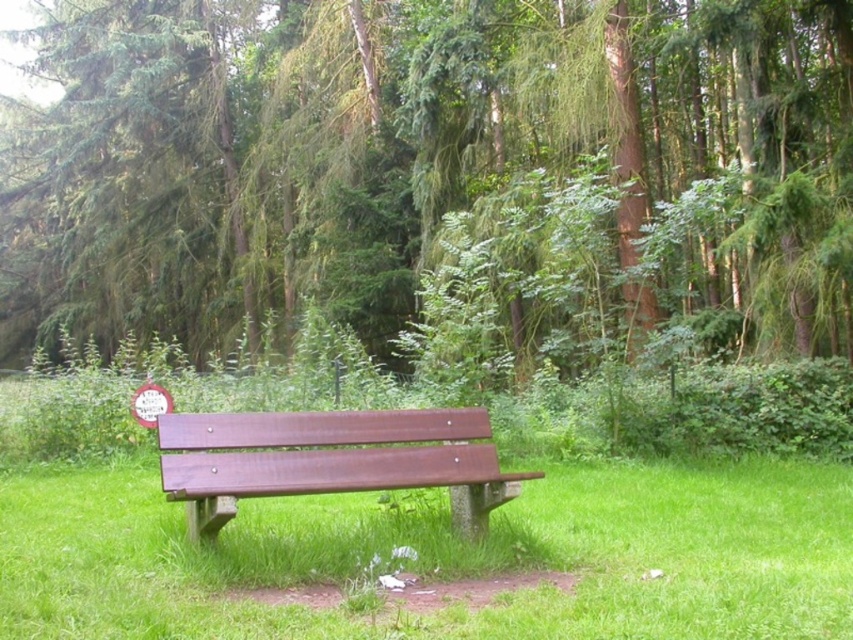
Question: Does green leafy tree at center have a greater width compared to wooden bench at center?

Choices:
 (A) yes
 (B) no

Answer: (A)

Question: Estimate the real-world distances between objects in this image. Which object is closer to the green leafy tree at center?

Choices:
 (A) brown wood bench at center
 (B) wooden bench at center

Answer: (B)

Question: Which of the following is the closest to the observer?

Choices:
 (A) brown wood bench at center
 (B) wooden bench at center
 (C) green leafy tree at center

Answer: (A)

Question: Can you confirm if green leafy tree at center is thinner than wooden bench at center?

Choices:
 (A) yes
 (B) no

Answer: (B)

Question: Does green leafy tree at center appear over wooden bench at center?

Choices:
 (A) yes
 (B) no

Answer: (A)

Question: Considering the real-world distances, which object is closest to the green leafy tree at center?

Choices:
 (A) brown wood bench at center
 (B) wooden bench at center

Answer: (B)